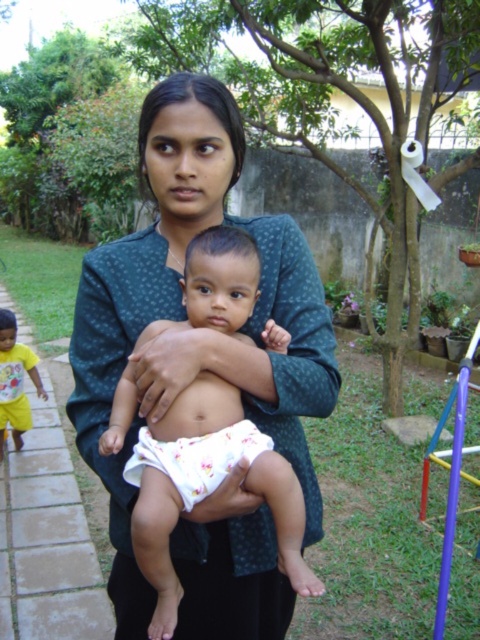
Question: Which point appears farthest from the camera in this image?

Choices:
 (A) (12, 336)
 (B) (223, 460)

Answer: (A)

Question: Which of the following is the closest to the observer?

Choices:
 (A) white clothed baby at center
 (B) floral cotton diaper at center
 (C) yellow cotton shirt at left

Answer: (A)

Question: Is floral cotton diaper at center further to the viewer compared to yellow cotton shirt at left?

Choices:
 (A) yes
 (B) no

Answer: (B)

Question: Can you confirm if white clothed baby at center is thinner than yellow cotton shirt at left?

Choices:
 (A) yes
 (B) no

Answer: (B)

Question: Which of these objects is positioned closest to the yellow cotton shirt at left?

Choices:
 (A) floral cotton diaper at center
 (B) white clothed baby at center

Answer: (B)

Question: Considering the relative positions of white clothed baby at center and yellow cotton shirt at left in the image provided, where is white clothed baby at center located with respect to yellow cotton shirt at left?

Choices:
 (A) below
 (B) above

Answer: (B)